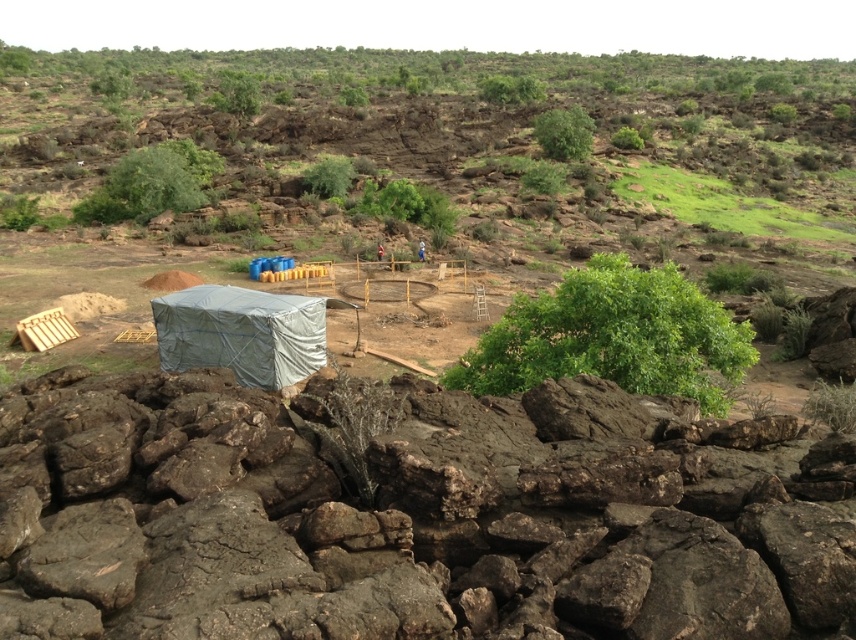
You are a hiker who wants to reach the green grassy hillside at upper center. Based on the coordinates provided, what direction should you head from your current position at the lower part of the frame?

The green grassy hillside at upper center is located at coordinates point (453, 129), so you should head towards the upper center direction from your current position at the lower part of the frame.